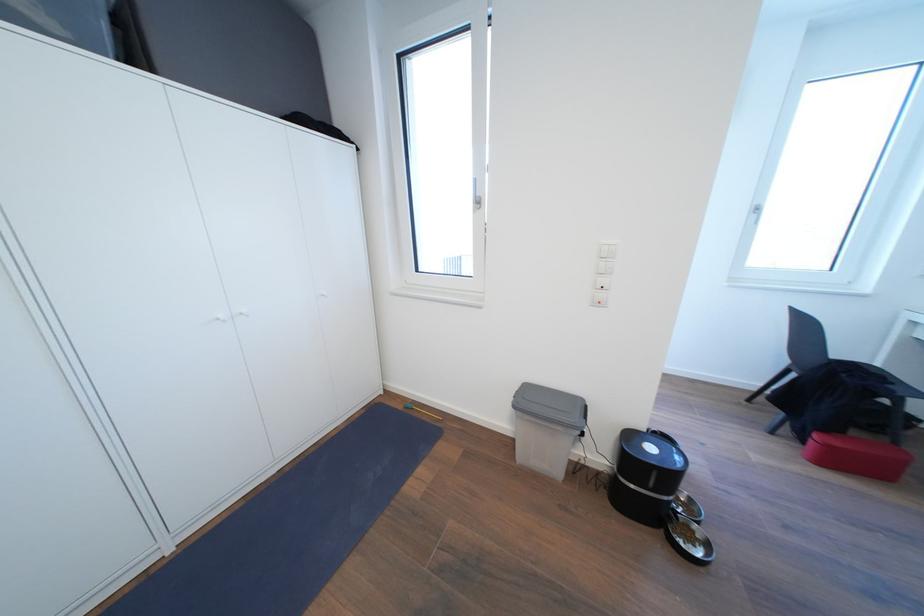
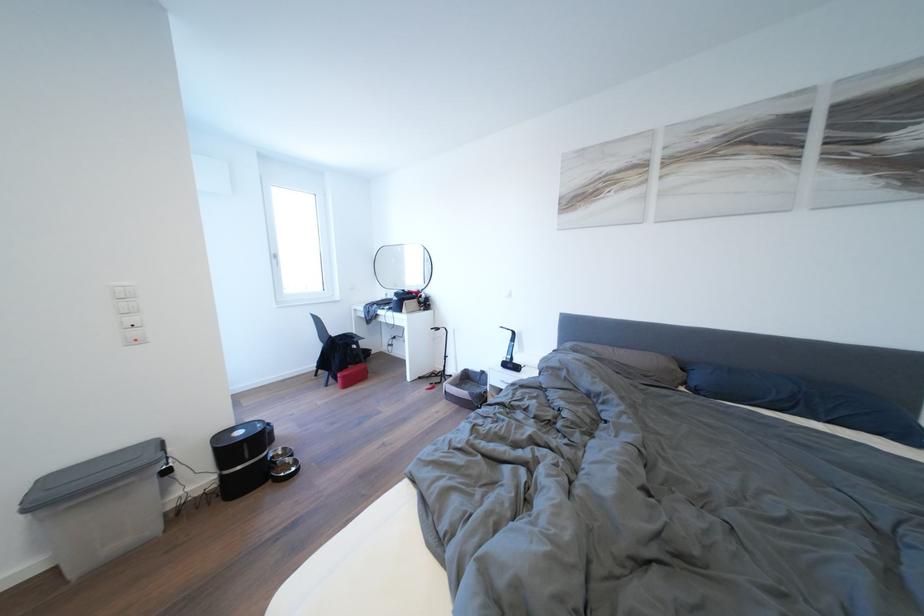
The point at (585, 424) is marked in the first image. Where is the corresponding point in the second image?

(160, 461)